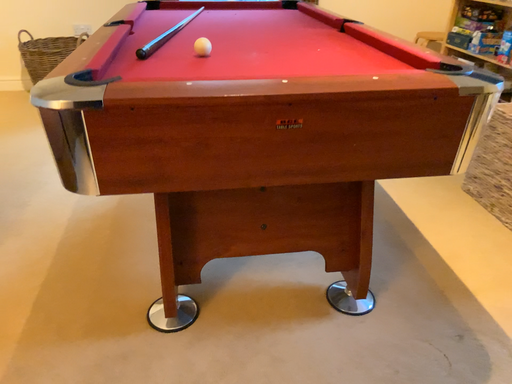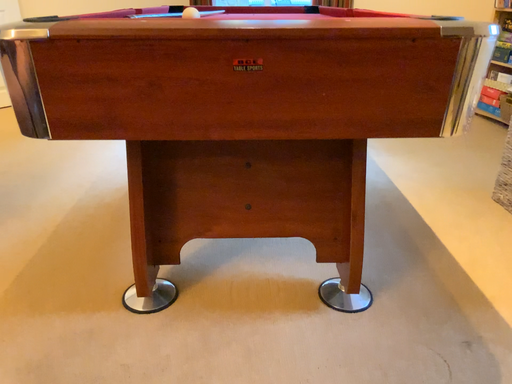
Question: How did the camera likely rotate when shooting the video?

Choices:
 (A) rotated right
 (B) rotated left

Answer: (B)